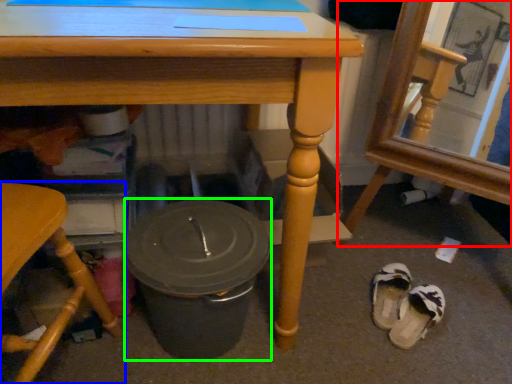
Question: Which object is positioned farthest from chair (highlighted by a red box)? Select from chair (highlighted by a blue box) and crock pot (highlighted by a green box).

Choices:
 (A) chair
 (B) crock pot

Answer: (A)